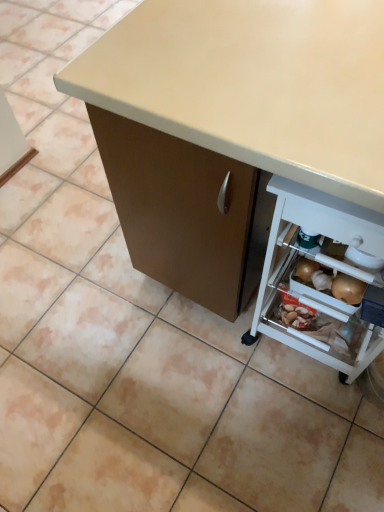
Identify the location of vacant space in front of white plastic shelf at lower right. (306, 432).